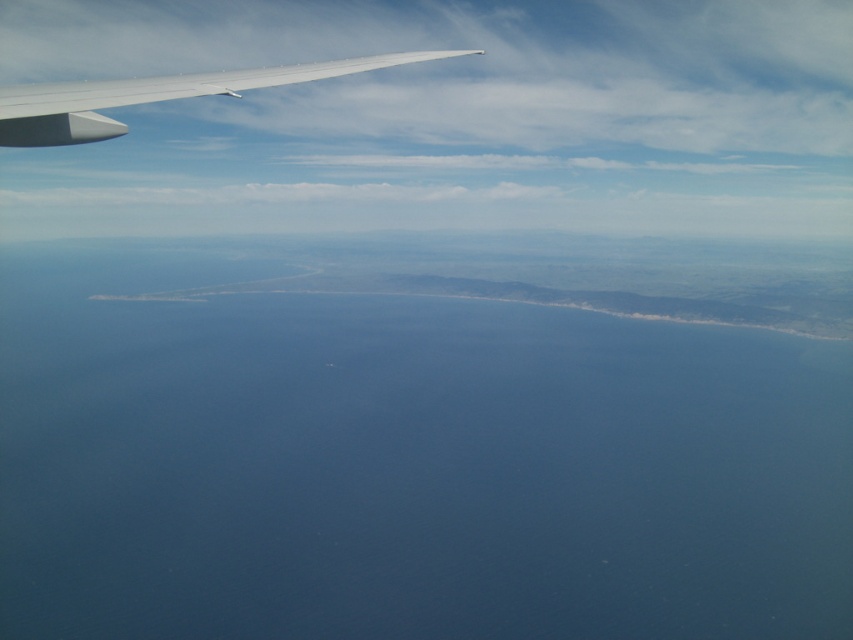
You are a passenger sitting in an airplane seat and looking out the window. You see the blue water at center and the white matte wing at upper left. Which object appears taller in the window?

The blue water at center appears taller than the white matte wing at upper left because it is much taller as described.

You are a passenger on an airplane and looking out the window. You see the blue water at center and the white matte wing at upper left. Which object appears bigger in the window?

The blue water at center appears bigger than the white matte wing at upper left because it is larger in size according to the description.